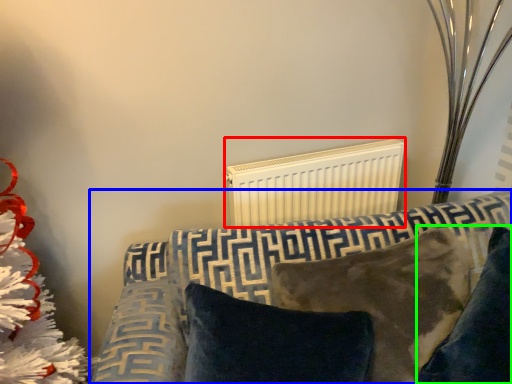
Question: Considering the real-world distances, which object is closest to radiator (highlighted by a red box)? furniture (highlighted by a blue box) or pillow (highlighted by a green box).

Choices:
 (A) furniture
 (B) pillow

Answer: (A)